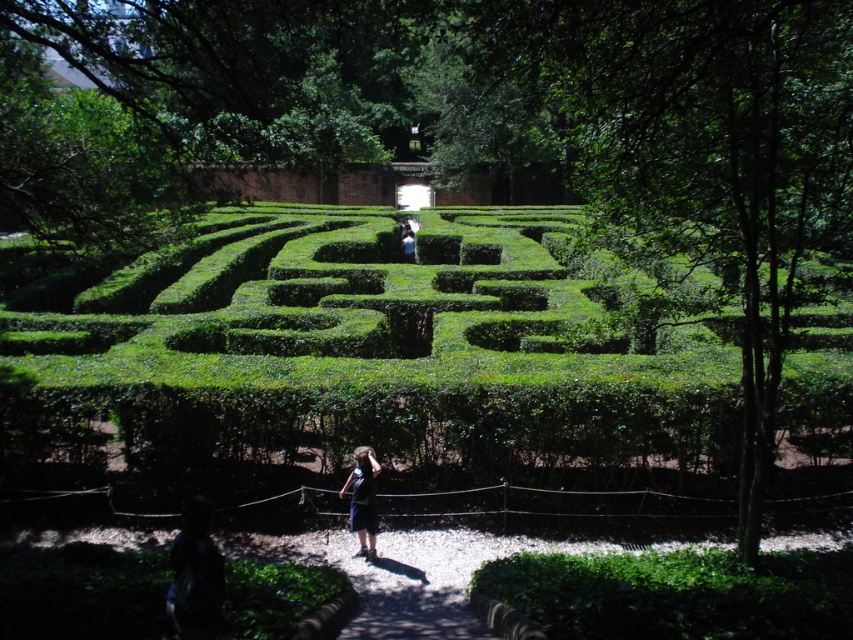
Is dark blue shirt at lower left wider than dark blue shirt at center?

No.

Who is positioned more to the left, dark blue shirt at lower left or dark blue shirt at center?

Positioned to the left is dark blue shirt at lower left.

Measure the distance between dark blue shirt at lower left and camera.

dark blue shirt at lower left is 5.15 meters away from camera.

Identify the location of dark blue shirt at lower left. This screenshot has height=640, width=853. (196, 577).

At what (x,y) coordinates should I click in order to perform the action: click on dark blue shorts at lower center. Please return your answer as a coordinate pair (x, y). Looking at the image, I should click on (363, 499).

Who is shorter, dark blue shorts at lower center or dark blue shirt at center?

With less height is dark blue shirt at center.

Image resolution: width=853 pixels, height=640 pixels. What do you see at coordinates (363, 499) in the screenshot?
I see `dark blue shorts at lower center` at bounding box center [363, 499].

The width and height of the screenshot is (853, 640). I want to click on dark blue shorts at lower center, so click(x=363, y=499).

Who is taller, dark blue shirt at lower left or dark blue shorts at lower center?

Standing taller between the two is dark blue shorts at lower center.

The width and height of the screenshot is (853, 640). Identify the location of dark blue shirt at lower left. (196, 577).

What are the coordinates of `dark blue shirt at lower left` in the screenshot? It's located at (196, 577).